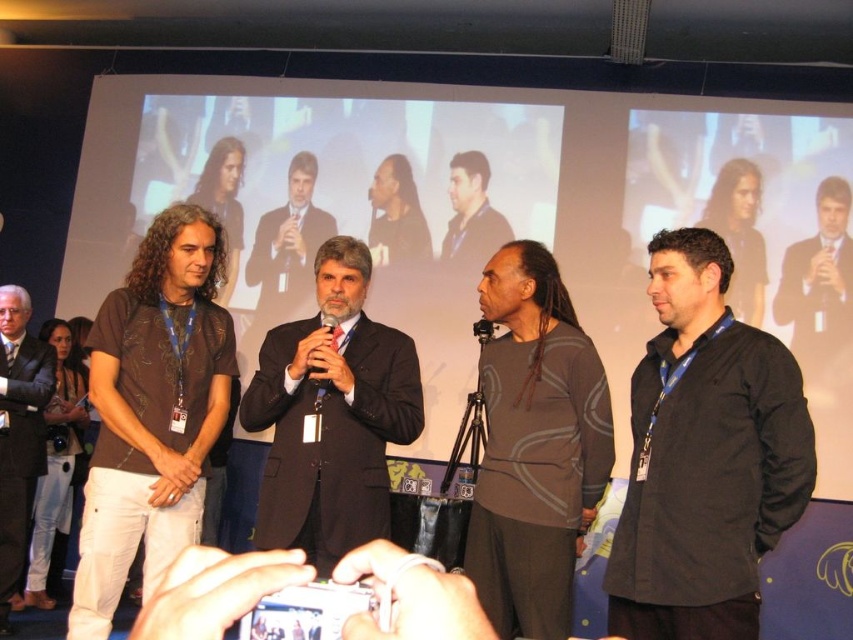
Question: Can you confirm if dark brown suit at center is smaller than black plastic microphone at center?

Choices:
 (A) yes
 (B) no

Answer: (B)

Question: Estimate the real-world distances between objects in this image. Which object is closer to the dark brown textured shirt at center?

Choices:
 (A) black plastic microphone at center
 (B) dark suit at center

Answer: (B)

Question: Does dark brown suit at center have a lesser width compared to dark brown textured shirt at center?

Choices:
 (A) yes
 (B) no

Answer: (A)

Question: Estimate the real-world distances between objects in this image. Which object is closer to the black matte microphone at center?

Choices:
 (A) dark brown textured shirt at center
 (B) black plastic microphone at center

Answer: (A)

Question: Can you confirm if dark suit at center is positioned above dark brown textured shirt at center?

Choices:
 (A) yes
 (B) no

Answer: (B)

Question: Which of the following is the farthest from the observer?

Choices:
 (A) dark brown suit at center
 (B) black matte jacket at right

Answer: (A)